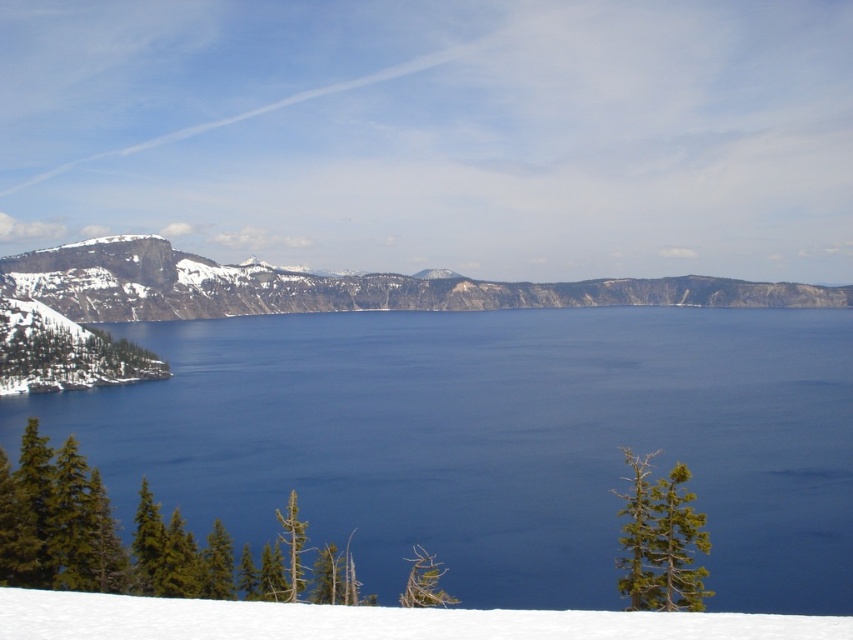
The height and width of the screenshot is (640, 853). What do you see at coordinates (332, 285) in the screenshot?
I see `dark gray rocky cliff at center` at bounding box center [332, 285].

Does dark gray rocky cliff at center come in front of white snow at lower center?

No, dark gray rocky cliff at center is further to the viewer.

Is point (10, 282) farther from viewer compared to point (144, 605)?

Yes, it is behind point (144, 605).

At what (x,y) coordinates should I click in order to perform the action: click on dark gray rocky cliff at center. Please return your answer as a coordinate pair (x, y). Looking at the image, I should click on (332, 285).

Is point (103, 504) positioned in front of point (146, 602)?

No, it is behind (146, 602).

Does green matte pine at lower center appear under white snow at lower center?

No, green matte pine at lower center is not below white snow at lower center.

This screenshot has width=853, height=640. I want to click on green matte pine at lower center, so click(x=141, y=540).

Find the location of a particular element. Image resolution: width=853 pixels, height=640 pixels. green matte pine at lower center is located at coordinates (141, 540).

Which of these two, deep blue water at center or dark gray rocky cliff at center, stands shorter?

Standing shorter between the two is deep blue water at center.

Find the location of a particular element. The width and height of the screenshot is (853, 640). deep blue water at center is located at coordinates (494, 442).

Does point (500, 312) come closer to viewer compared to point (410, 276)?

Yes, it is in front of point (410, 276).

Identify the location of deep blue water at center. Image resolution: width=853 pixels, height=640 pixels. pyautogui.click(x=494, y=442).